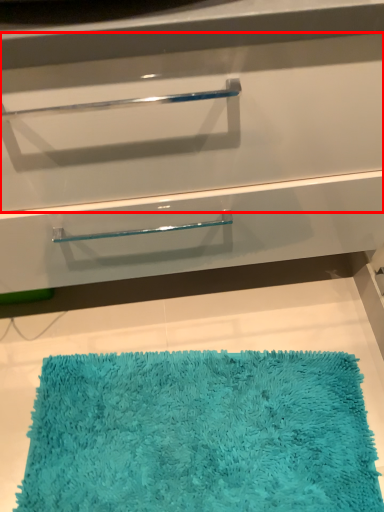
Question: From the image's perspective, where is drawer (annotated by the red box) located in relation to bath mat in the image?

Choices:
 (A) below
 (B) above

Answer: (B)